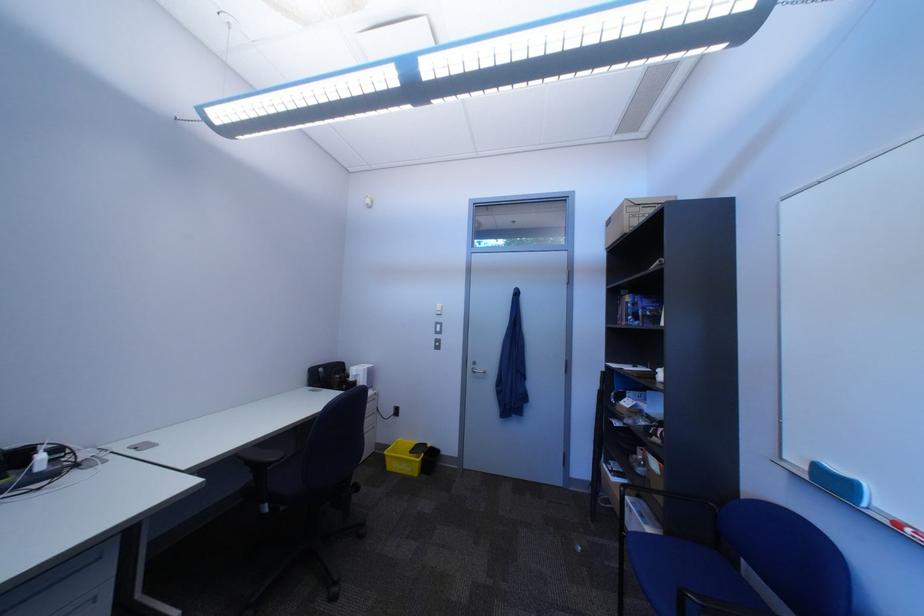
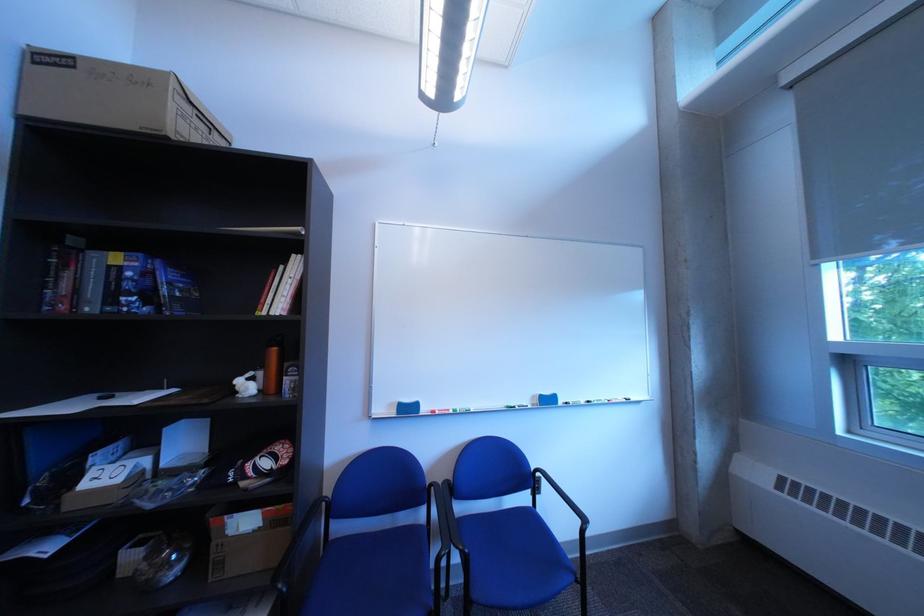
Locate, in the second image, the point that corresponds to (x=647, y=318) in the first image.

(150, 300)